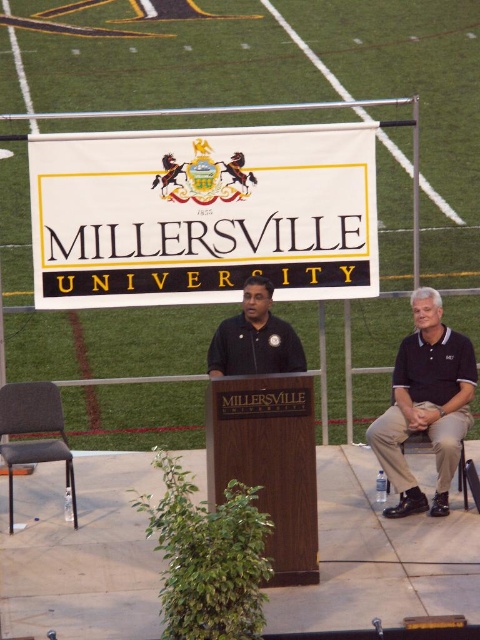
Question: Can you confirm if white fabric sign at center is smaller than matte gray chair at left?

Choices:
 (A) no
 (B) yes

Answer: (A)

Question: Which object is farther from the camera taking this photo?

Choices:
 (A) dark blue polo shirt at right
 (B) green artificial turf at upper center

Answer: (B)

Question: Which of the following is the closest to the observer?

Choices:
 (A) (100, 100)
 (B) (20, 401)
 (C) (416, 496)
 (D) (265, 314)

Answer: (C)

Question: From the image, what is the correct spatial relationship of green artificial turf at upper center in relation to black smooth shirt at center?

Choices:
 (A) left
 (B) right

Answer: (B)

Question: Can you confirm if dark blue polo shirt at right is positioned to the right of matte gray chair at left?

Choices:
 (A) yes
 (B) no

Answer: (A)

Question: Which of the following is the closest to the observer?

Choices:
 (A) (135, 266)
 (B) (54, 452)
 (C) (211, 72)
 (D) (458, 396)

Answer: (B)